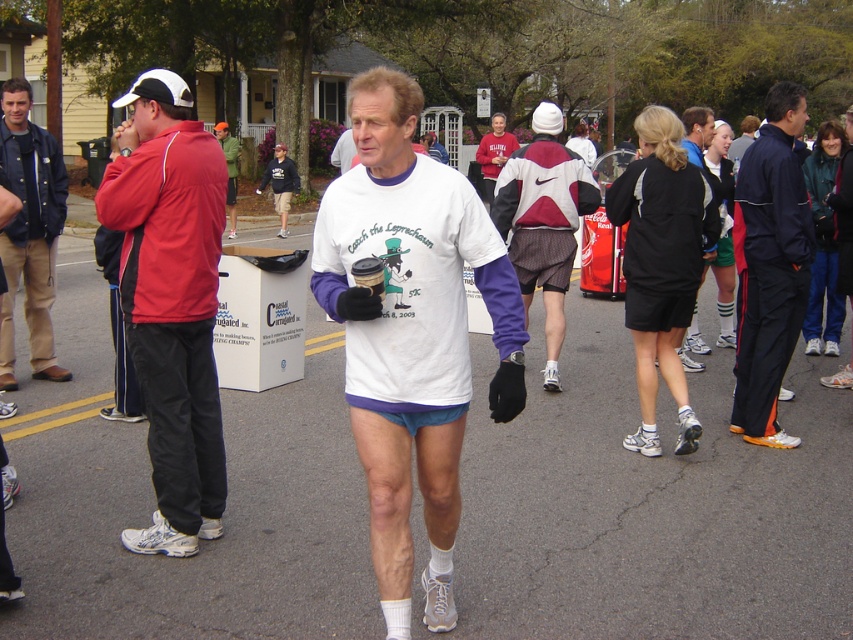
Can you confirm if white matte t-shirt at center is bigger than dark blue track suit at right?

Indeed, white matte t-shirt at center has a larger size compared to dark blue track suit at right.

Is white matte t-shirt at center above dark blue track suit at right?

Yes, white matte t-shirt at center is above dark blue track suit at right.

Does point (369, 298) come behind point (753, 273)?

That is False.

Locate an element on the screen. The image size is (853, 640). white matte t-shirt at center is located at coordinates (410, 332).

Based on the photo, between red jacket at left and dark blue track suit at right, which one appears on the right side from the viewer's perspective?

Positioned to the right is dark blue track suit at right.

Does red jacket at left appear on the left side of dark blue track suit at right?

Correct, you'll find red jacket at left to the left of dark blue track suit at right.

Does point (151, 532) come farther from viewer compared to point (776, 248)?

That is False.

You are a GUI agent. You are given a task and a screenshot of the screen. Output one action in this format:
    pyautogui.click(x=<x>, y=<y>)
    Task: Click on the red jacket at left
    
    Given the screenshot: What is the action you would take?
    pyautogui.click(x=170, y=301)

Is black fabric shorts at center positioned before dark blue track suit at right?

Yes.

What do you see at coordinates (660, 264) in the screenshot?
I see `black fabric shorts at center` at bounding box center [660, 264].

This screenshot has height=640, width=853. I want to click on black fabric shorts at center, so click(x=660, y=264).